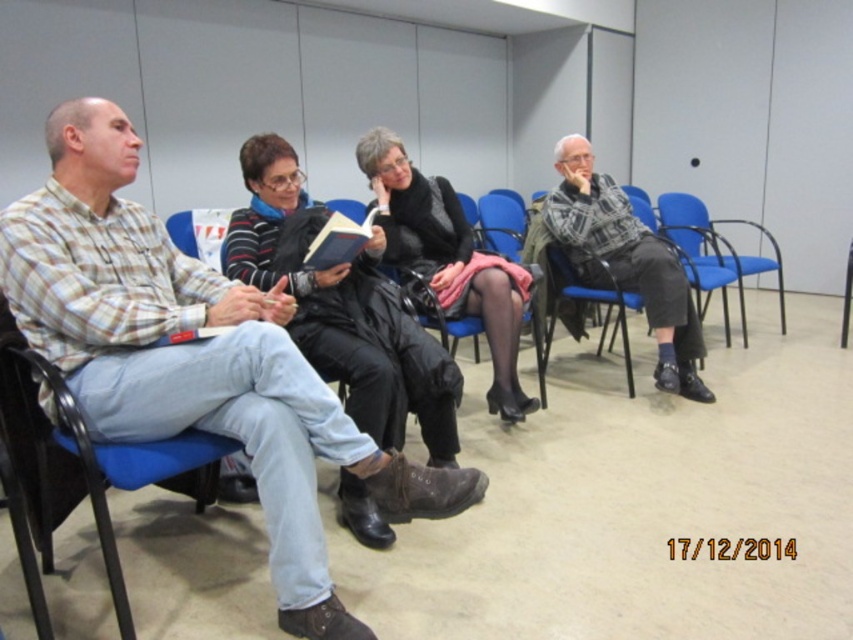
You are standing in front of the group of four individuals seated in blue chairs. There are two points marked in the scene. The first point is at coordinates point [518,387] and the second point is at coordinates point [699,248]. Which of these two points is closer to you?

The point at coordinates point [518,387] is closer to the viewer than point [699,248].

You are a delivery person who needs to place a package on the floor between the black leather jacket at center and the blue plastic chair at center. The package is 1.5 meters long. Will it fit in the space between them?

The distance between the black leather jacket at center and the blue plastic chair at center is 1.53 meters. Since the package is 1.5 meters long, it will fit with a small amount of space remaining.